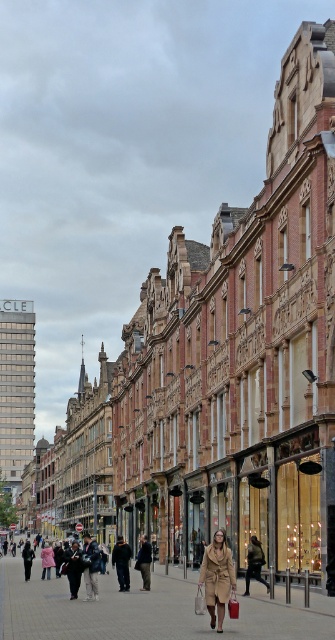
Can you confirm if camel wool coat at center is smaller than matte beige shopping bag at center?

Incorrect, camel wool coat at center is not smaller in size than matte beige shopping bag at center.

Consider the image. Between camel wool coat at center and matte beige shopping bag at center, which one is positioned higher?

camel wool coat at center is higher up.

You are a GUI agent. You are given a task and a screenshot of the screen. Output one action in this format:
    pyautogui.click(x=<x>, y=<y>)
    Task: Click on the camel wool coat at center
    The height and width of the screenshot is (640, 335).
    Given the screenshot: What is the action you would take?
    pyautogui.click(x=217, y=577)

Which is more to the left, brick pavement at center or matte beige shopping bag at center?

Positioned to the left is brick pavement at center.

Is brick pavement at center to the right of matte beige shopping bag at center from the viewer's perspective?

Incorrect, brick pavement at center is not on the right side of matte beige shopping bag at center.

Describe the element at coordinates (145, 611) in the screenshot. I see `brick pavement at center` at that location.

I want to click on brick pavement at center, so click(x=145, y=611).

Is brick pavement at center smaller than camel wool coat at center?

No, brick pavement at center is not smaller than camel wool coat at center.

Is point (158, 618) in front of point (218, 579)?

That is False.

Identify the location of brick pavement at center. (145, 611).